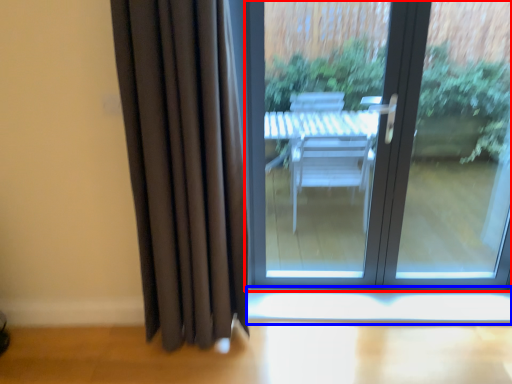
Question: Which object is closer to the camera taking this photo, door (highlighted by a red box) or window sill (highlighted by a blue box)?

Choices:
 (A) door
 (B) window sill

Answer: (A)